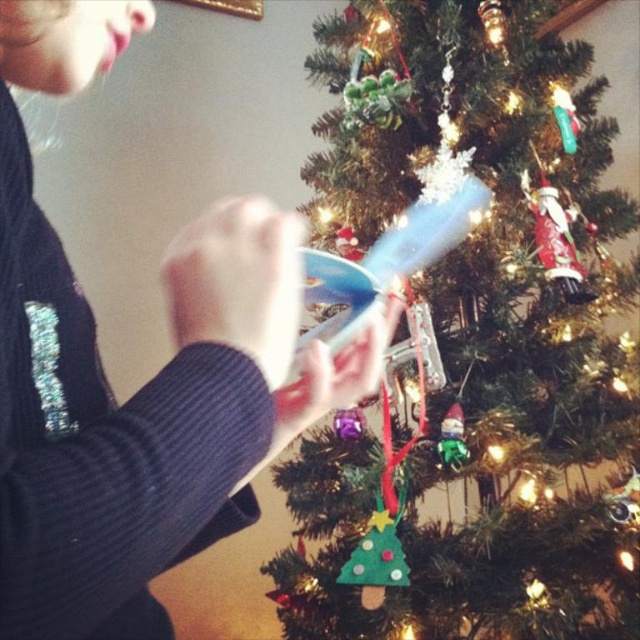
Measure the distance between point (400, 49) and camera.

Point (400, 49) is 4.56 feet from camera.

Who is more forward, (308, 442) or (198, 248)?

Point (198, 248)

Where is `green felt ornament at center`? green felt ornament at center is located at coordinates (481, 356).

Does dark blue sweater at upper left have a greater height compared to green felt gnome at lower center?

Yes.

Which of these two, dark blue sweater at upper left or green felt gnome at lower center, stands shorter?

Standing shorter between the two is green felt gnome at lower center.

At what (x,y) coordinates should I click in order to perform the action: click on dark blue sweater at upper left. Please return your answer as a coordinate pair (x, y). The width and height of the screenshot is (640, 640). Looking at the image, I should click on [x=145, y=384].

Locate an element on the screen. dark blue sweater at upper left is located at coordinates (145, 384).

Does green felt ornament at center have a greater width compared to green felt gnome at lower center?

Correct, the width of green felt ornament at center exceeds that of green felt gnome at lower center.

Can you confirm if green felt ornament at center is shorter than green felt gnome at lower center?

Incorrect, green felt ornament at center's height does not fall short of green felt gnome at lower center's.

Which is in front, point (625, 305) or point (456, 428)?

Point (456, 428)

You are a GUI agent. You are given a task and a screenshot of the screen. Output one action in this format:
    pyautogui.click(x=<x>, y=<y>)
    Task: Click on the green felt ornament at center
    This screenshot has height=640, width=640.
    Given the screenshot: What is the action you would take?
    pyautogui.click(x=481, y=356)